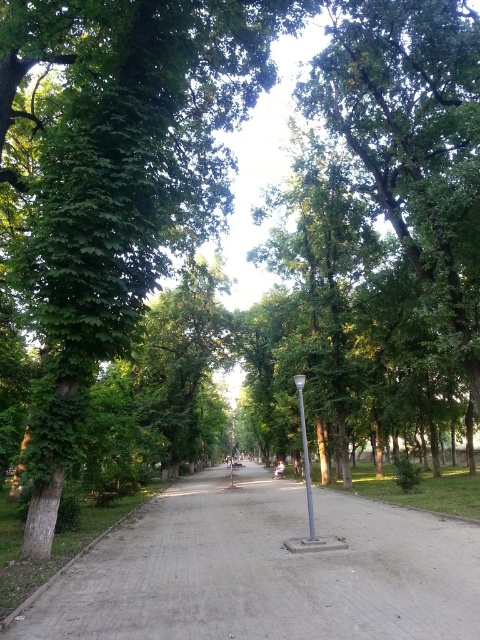
Question: Is gray concrete pavement at center in front of silver metallic pole at center?

Choices:
 (A) yes
 (B) no

Answer: (A)

Question: Is gray concrete pavement at center thinner than silver metallic pole at center?

Choices:
 (A) no
 (B) yes

Answer: (A)

Question: Does gray concrete pavement at center have a greater width compared to silver metallic pole at center?

Choices:
 (A) no
 (B) yes

Answer: (B)

Question: Which point is farther to the camera?

Choices:
 (A) (108, 620)
 (B) (301, 444)

Answer: (B)